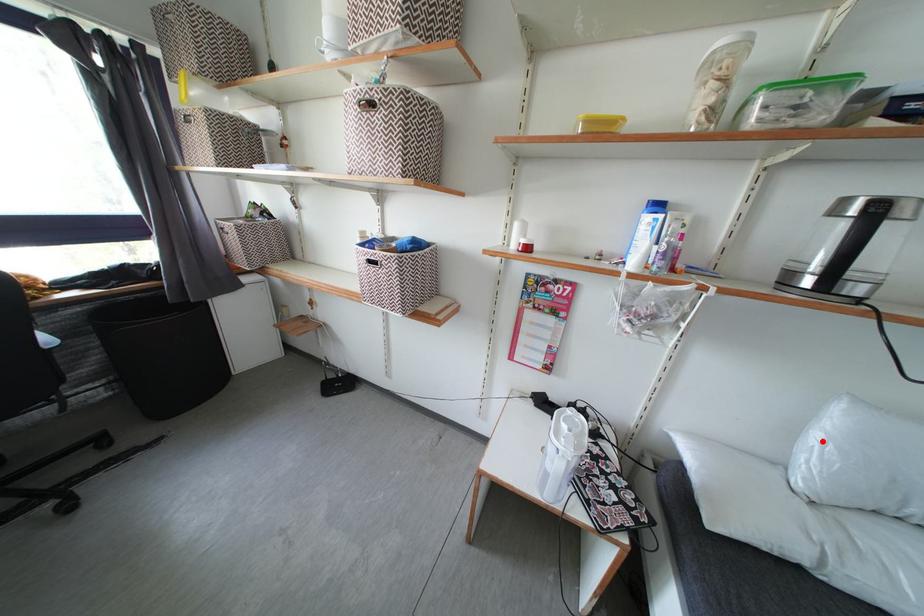
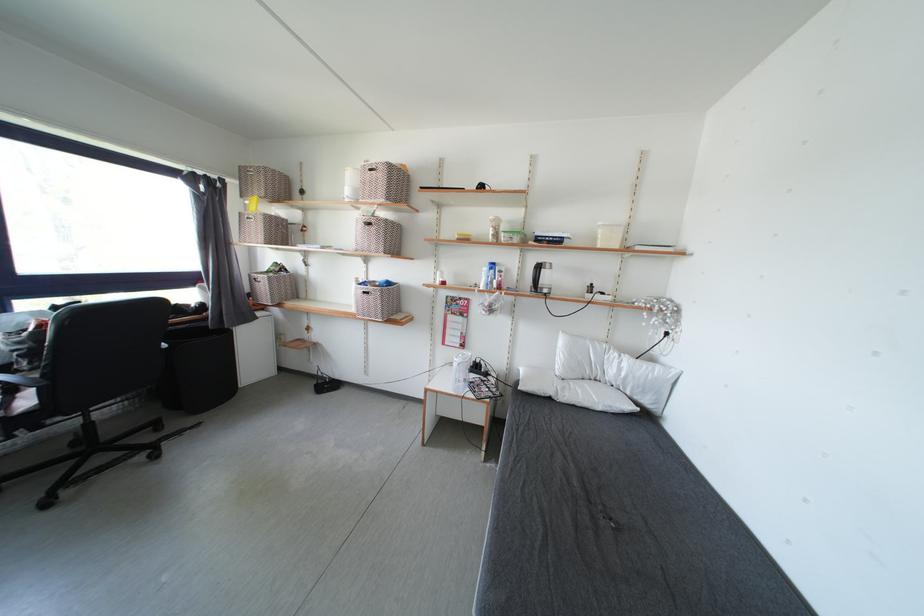
Find the pixel in the second image that matches the highlighted location in the first image.

(565, 355)